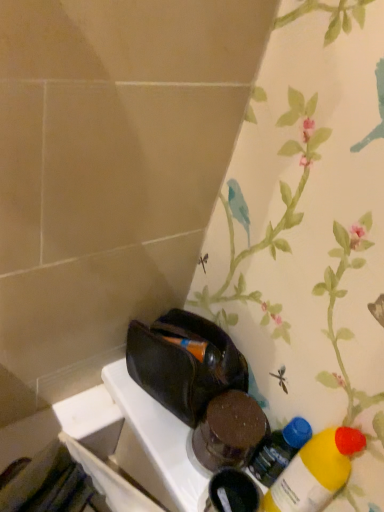
Image resolution: width=384 pixels, height=512 pixels. Identify the location of yellow matte bottle at lower right, the 1th bottle from the front. (315, 472).

Describe the element at coordinates (315, 472) in the screenshot. This screenshot has width=384, height=512. I see `yellow matte bottle at lower right, which appears as the second bottle when viewed from the back` at that location.

How much space does translucent plastic bottle at lower right, which is the second bottle from front to back, occupy vertically?

translucent plastic bottle at lower right, which is the second bottle from front to back, is 18.64 centimeters tall.

What are the coordinates of `translucent plastic bottle at lower right, marked as the 1th bottle in a back-to-front arrangement` in the screenshot? It's located at (278, 450).

Describe the element at coordinates (278, 450) in the screenshot. I see `translucent plastic bottle at lower right, which is the second bottle from front to back` at that location.

Locate an element on the screen. yellow matte bottle at lower right, the 1th bottle from the front is located at coordinates (315, 472).

In the image, is yellow matte bottle at lower right, which appears as the second bottle when viewed from the back, on the left side or the right side of translucent plastic bottle at lower right, marked as the 1th bottle in a back-to-front arrangement?

Based on their positions, yellow matte bottle at lower right, which appears as the second bottle when viewed from the back, is located to the right of translucent plastic bottle at lower right, marked as the 1th bottle in a back-to-front arrangement.

Which object is further away from the camera, yellow matte bottle at lower right, the 1th bottle from the front, or translucent plastic bottle at lower right, which is the second bottle from front to back?

translucent plastic bottle at lower right, which is the second bottle from front to back, is more distant.

Does point (327, 489) come closer to viewer compared to point (253, 458)?

Yes, it is in front of point (253, 458).

From the image's perspective, which one is positioned higher, yellow matte bottle at lower right, the 1th bottle from the front, or translucent plastic bottle at lower right, which is the second bottle from front to back?

translucent plastic bottle at lower right, which is the second bottle from front to back, is shown above in the image.

From a real-world perspective, is yellow matte bottle at lower right, the 1th bottle from the front, positioned above or below translucent plastic bottle at lower right, which is the second bottle from front to back?

In terms of real-world spatial position, yellow matte bottle at lower right, the 1th bottle from the front, is above translucent plastic bottle at lower right, which is the second bottle from front to back.

From the picture: Considering the sizes of objects yellow matte bottle at lower right, which appears as the second bottle when viewed from the back, and translucent plastic bottle at lower right, marked as the 1th bottle in a back-to-front arrangement, in the image provided, who is wider, yellow matte bottle at lower right, which appears as the second bottle when viewed from the back, or translucent plastic bottle at lower right, marked as the 1th bottle in a back-to-front arrangement,?

Wider between the two is yellow matte bottle at lower right, which appears as the second bottle when viewed from the back.

Can you confirm if yellow matte bottle at lower right, the 1th bottle from the front, is taller than translucent plastic bottle at lower right, marked as the 1th bottle in a back-to-front arrangement?

Correct, yellow matte bottle at lower right, the 1th bottle from the front, is much taller as translucent plastic bottle at lower right, marked as the 1th bottle in a back-to-front arrangement.

From the picture: Who is bigger, yellow matte bottle at lower right, which appears as the second bottle when viewed from the back, or translucent plastic bottle at lower right, which is the second bottle from front to back?

yellow matte bottle at lower right, which appears as the second bottle when viewed from the back, is bigger.

Is translucent plastic bottle at lower right, which is the second bottle from front to back, inside yellow matte bottle at lower right, which appears as the second bottle when viewed from the back?

No, translucent plastic bottle at lower right, which is the second bottle from front to back, is located outside of yellow matte bottle at lower right, which appears as the second bottle when viewed from the back.

Is yellow matte bottle at lower right, the 1th bottle from the front, with translucent plastic bottle at lower right, marked as the 1th bottle in a back-to-front arrangement?

Indeed, yellow matte bottle at lower right, the 1th bottle from the front, and translucent plastic bottle at lower right, marked as the 1th bottle in a back-to-front arrangement, are beside each other and touching.

Is yellow matte bottle at lower right, the 1th bottle from the front, positioned with its back to translucent plastic bottle at lower right, which is the second bottle from front to back?

No, translucent plastic bottle at lower right, which is the second bottle from front to back, is not at the back of yellow matte bottle at lower right, the 1th bottle from the front.

Can you tell me how much yellow matte bottle at lower right, which appears as the second bottle when viewed from the back, and translucent plastic bottle at lower right, marked as the 1th bottle in a back-to-front arrangement, differ in facing direction?

The facing directions of yellow matte bottle at lower right, which appears as the second bottle when viewed from the back, and translucent plastic bottle at lower right, marked as the 1th bottle in a back-to-front arrangement, are 0.00126 degrees apart.

How distant is yellow matte bottle at lower right, the 1th bottle from the front, from translucent plastic bottle at lower right, marked as the 1th bottle in a back-to-front arrangement?

2.06 inches.

What are the coordinates of `bottle behind the yellow matte bottle at lower right, which appears as the second bottle when viewed from the back` in the screenshot? It's located at (278, 450).

Which object is positioned more to the right, translucent plastic bottle at lower right, marked as the 1th bottle in a back-to-front arrangement, or yellow matte bottle at lower right, which appears as the second bottle when viewed from the back?

Positioned to the right is yellow matte bottle at lower right, which appears as the second bottle when viewed from the back.

Does translucent plastic bottle at lower right, which is the second bottle from front to back, come in front of yellow matte bottle at lower right, the 1th bottle from the front?

No, the depth of translucent plastic bottle at lower right, which is the second bottle from front to back, is greater than that of yellow matte bottle at lower right, the 1th bottle from the front.

Does point (276, 445) appear closer or farther from the camera than point (304, 483)?

Point (276, 445) is positioned farther from the camera compared to point (304, 483).

From the image's perspective, does translucent plastic bottle at lower right, marked as the 1th bottle in a back-to-front arrangement, appear lower than yellow matte bottle at lower right, which appears as the second bottle when viewed from the back?

No, from the image's perspective, translucent plastic bottle at lower right, marked as the 1th bottle in a back-to-front arrangement, is not below yellow matte bottle at lower right, which appears as the second bottle when viewed from the back.

From a real-world perspective, relative to yellow matte bottle at lower right, the 1th bottle from the front, is translucent plastic bottle at lower right, which is the second bottle from front to back, vertically above or below?

Clearly, from a real-world perspective, translucent plastic bottle at lower right, which is the second bottle from front to back, is below yellow matte bottle at lower right, the 1th bottle from the front.

Looking at this image, which of these two, translucent plastic bottle at lower right, which is the second bottle from front to back, or yellow matte bottle at lower right, which appears as the second bottle when viewed from the back, is wider?

yellow matte bottle at lower right, which appears as the second bottle when viewed from the back.

From their relative heights in the image, would you say translucent plastic bottle at lower right, marked as the 1th bottle in a back-to-front arrangement, is taller or shorter than yellow matte bottle at lower right, the 1th bottle from the front?

In the image, translucent plastic bottle at lower right, marked as the 1th bottle in a back-to-front arrangement, appears to be shorter than yellow matte bottle at lower right, the 1th bottle from the front.

Between translucent plastic bottle at lower right, marked as the 1th bottle in a back-to-front arrangement, and yellow matte bottle at lower right, which appears as the second bottle when viewed from the back, which one has larger size?

With larger size is yellow matte bottle at lower right, which appears as the second bottle when viewed from the back.

Would you say translucent plastic bottle at lower right, marked as the 1th bottle in a back-to-front arrangement, contains yellow matte bottle at lower right, the 1th bottle from the front?

No, yellow matte bottle at lower right, the 1th bottle from the front, is not a part of translucent plastic bottle at lower right, marked as the 1th bottle in a back-to-front arrangement.

Is translucent plastic bottle at lower right, marked as the 1th bottle in a back-to-front arrangement, placed right next to yellow matte bottle at lower right, the 1th bottle from the front?

Absolutely, translucent plastic bottle at lower right, marked as the 1th bottle in a back-to-front arrangement, is next to and touching yellow matte bottle at lower right, the 1th bottle from the front.

Does translucent plastic bottle at lower right, marked as the 1th bottle in a back-to-front arrangement, turn towards yellow matte bottle at lower right, which appears as the second bottle when viewed from the back?

No, translucent plastic bottle at lower right, marked as the 1th bottle in a back-to-front arrangement, is not facing towards yellow matte bottle at lower right, which appears as the second bottle when viewed from the back.

How far apart are translucent plastic bottle at lower right, marked as the 1th bottle in a back-to-front arrangement, and yellow matte bottle at lower right, the 1th bottle from the front?

translucent plastic bottle at lower right, marked as the 1th bottle in a back-to-front arrangement, is 2.06 inches from yellow matte bottle at lower right, the 1th bottle from the front.

In the image, there is a translucent plastic bottle at lower right, which is the second bottle from front to back. Where is `bottle below it (from the image's perspective)`? This screenshot has width=384, height=512. bottle below it (from the image's perspective) is located at coordinates (315, 472).

Identify the location of bottle that appears in front of the translucent plastic bottle at lower right, marked as the 1th bottle in a back-to-front arrangement. (315, 472).

Find the location of `bottle that is under the yellow matte bottle at lower right, which appears as the second bottle when viewed from the back (from a real-world perspective)`. bottle that is under the yellow matte bottle at lower right, which appears as the second bottle when viewed from the back (from a real-world perspective) is located at coordinates (278, 450).